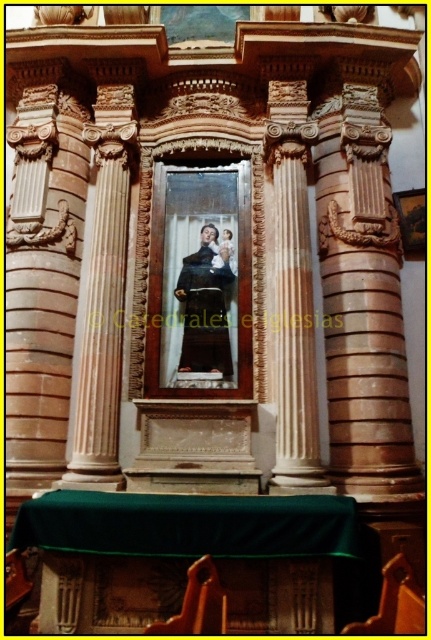
You are an art conservator assessing the placement of objects in this religious artwork. Based on the scene, can you determine if the brown polished stone column at right is positioned higher than the matte black robe at center?

The brown polished stone column at right is located above the matte black robe at center, so yes, it is positioned higher.

You are an interior designer assessing the space for a new sculpture. The sculpture will be placed between the brown polished stone column at right and the matte black robe at center. Given their sizes, which object should the sculpture be placed closer to for visual balance?

The brown polished stone column at right is larger in size than the matte black robe at center, so the sculpture should be placed closer to the matte black robe at center to achieve visual balance.